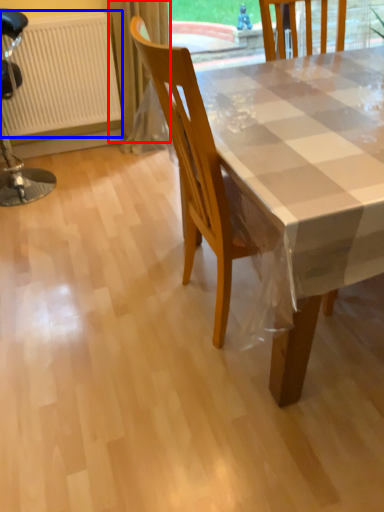
Question: Which object is closer to the camera taking this photo, curtain (highlighted by a red box) or radiator (highlighted by a blue box)?

Choices:
 (A) curtain
 (B) radiator

Answer: (B)